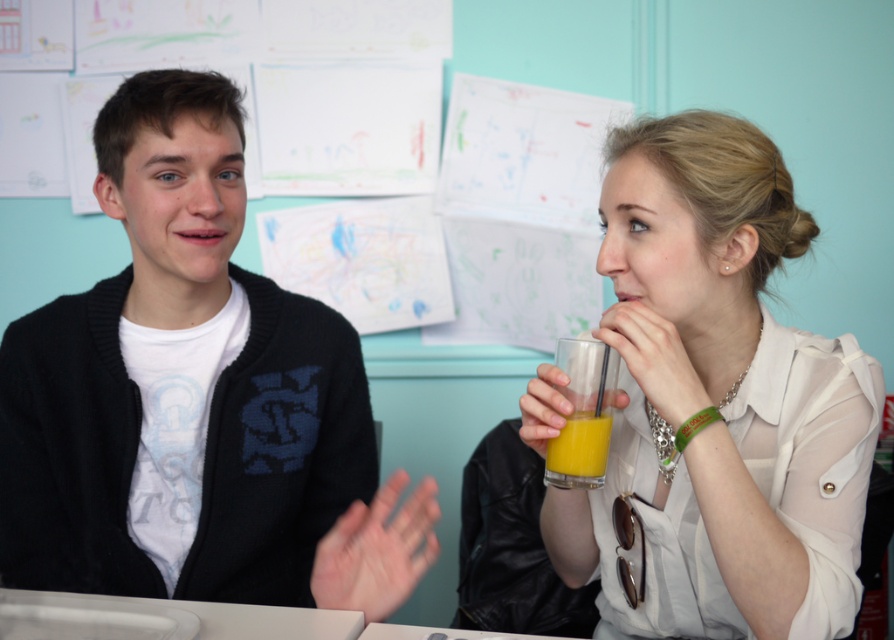
You are organizing a small event and need to place a decorative item between the black matte sweater at center and the orange liquid glass at center. Which object should you place the item closer to to ensure it doesn

The orange liquid glass at center is narrower than the black matte sweater at center, so placing the decorative item closer to the orange liquid glass at center would allow more space between them.

You are at a table in a classroom setting and want to place a book on the white glossy table at center. However, there is a translucent glass of orange juice at center in the way. Can you place the book on the table without moving the glass?

The white glossy table at center is to the left of the translucent glass of orange juice at center, so you can place the book on the table to the left of the glass.